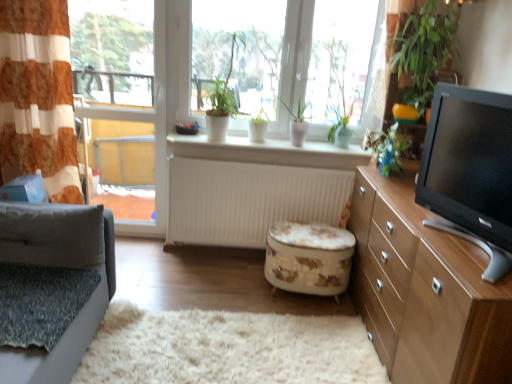
Question: Looking at their shapes, would you say black glossy tv at right is wider or thinner than clear glass window at left?

Choices:
 (A) thin
 (B) wide

Answer: (B)

Question: From the image's perspective, is black glossy tv at right located above or below clear glass window at left?

Choices:
 (A) above
 (B) below

Answer: (B)

Question: Considering the real-world distances, which object is closest to the orange striped fabric at left?

Choices:
 (A) light brown wood cabinet at right
 (B) white glossy plants at upper center
 (C) clear glass window at left
 (D) gray fabric studio couch at left
 (E) white matte window sill at center

Answer: (C)

Question: Estimate the real-world distances between objects in this image. Which object is farther from the clear glass window at left?

Choices:
 (A) black glossy tv at right
 (B) orange striped fabric at left
 (C) gray fabric studio couch at left
 (D) white glossy plants at upper center
 (E) green matte plant at center, which is the 1th plant in left-to-right order

Answer: (A)